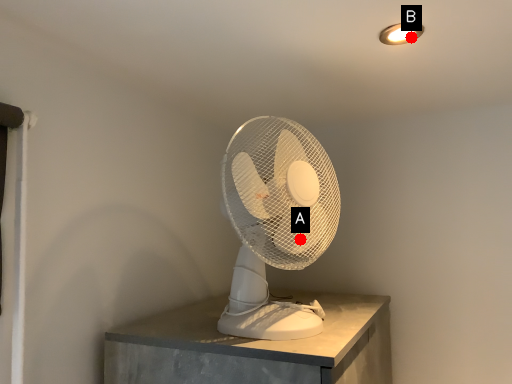
Question: Two points are circled on the image, labeled by A and B beside each circle. Which of the following is the farthest from the observer?

Choices:
 (A) A is further
 (B) B is further

Answer: (A)